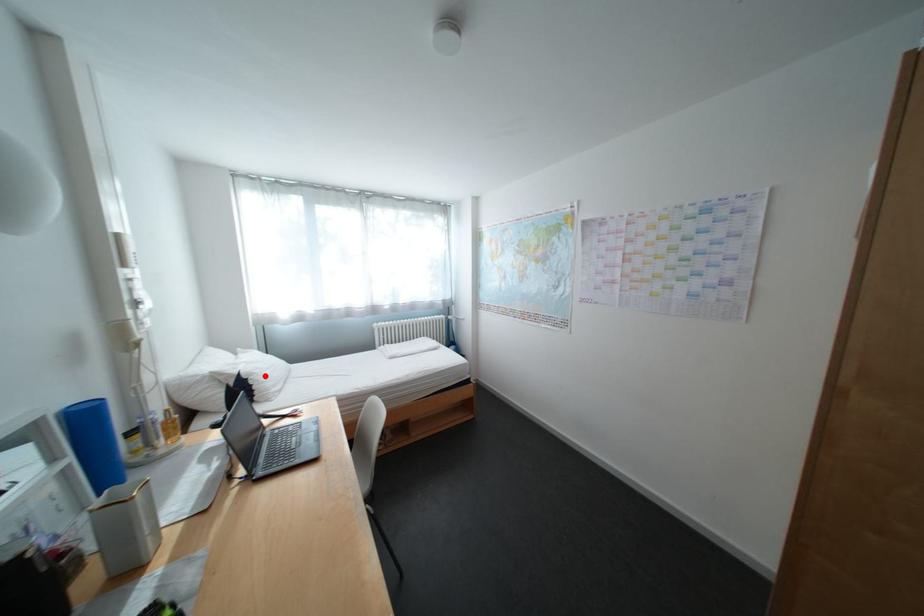
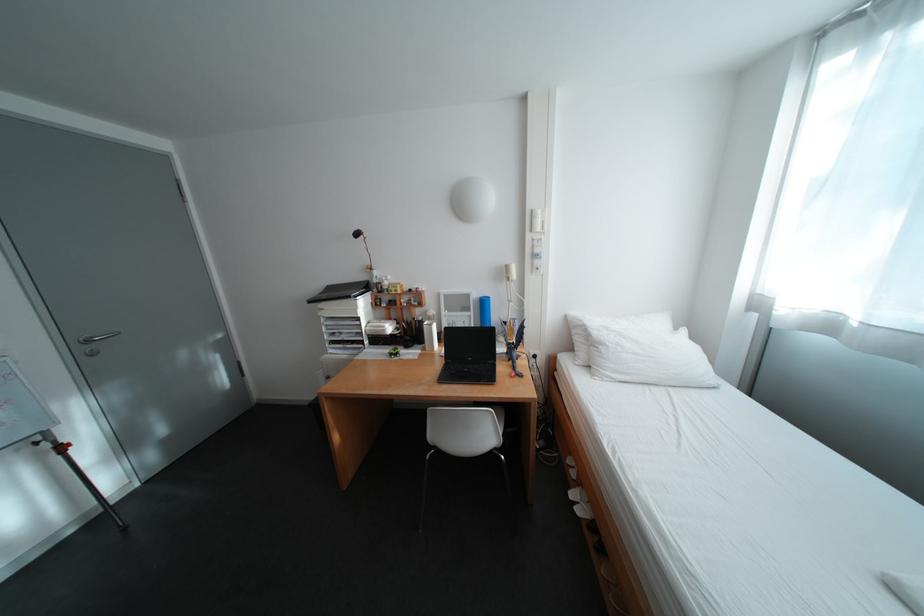
Find the pixel in the second image that matches the highlighted location in the first image.

(614, 346)